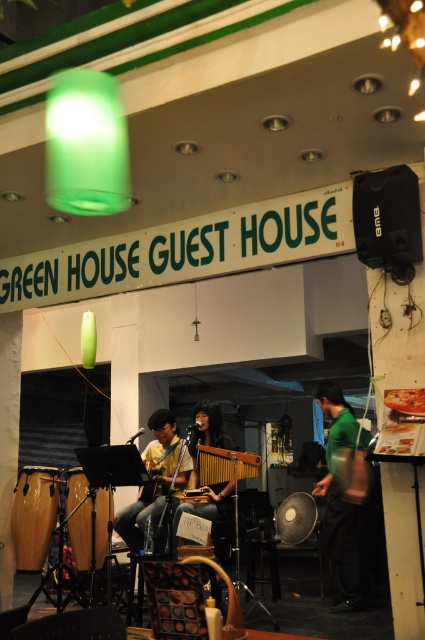
The image size is (425, 640). Describe the element at coordinates (152, 483) in the screenshot. I see `yellow fabric guitar at center` at that location.

Is yellow fabric guitar at center below smooth brown guitar at center?

Yes.

Who is more distant from viewer, (167,445) or (223,496)?

The point (167,445) is behind.

Where is `yellow fabric guitar at center`? yellow fabric guitar at center is located at coordinates (152, 483).

Can you confirm if green matte shirt at center is wider than wooden xylophone at center?

In fact, green matte shirt at center might be narrower than wooden xylophone at center.

Between green matte shirt at center and wooden xylophone at center, which one appears on the left side from the viewer's perspective?

Positioned to the left is wooden xylophone at center.

Describe the element at coordinates (340, 497) in the screenshot. I see `green matte shirt at center` at that location.

At what (x,y) coordinates should I click in order to perform the action: click on green matte shirt at center. Please return your answer as a coordinate pair (x, y). Looking at the image, I should click on (340, 497).

Looking at this image, does yellow fabric guitar at center have a smaller size compared to wooden xylophone at center?

Incorrect, yellow fabric guitar at center is not smaller in size than wooden xylophone at center.

Which is behind, point (115, 529) or point (246, 464)?

The point (115, 529) is behind.

You are a GUI agent. You are given a task and a screenshot of the screen. Output one action in this format:
    pyautogui.click(x=<x>, y=<y>)
    Task: Click on the yellow fabric guitar at center
    The image size is (425, 640).
    Given the screenshot: What is the action you would take?
    pyautogui.click(x=152, y=483)